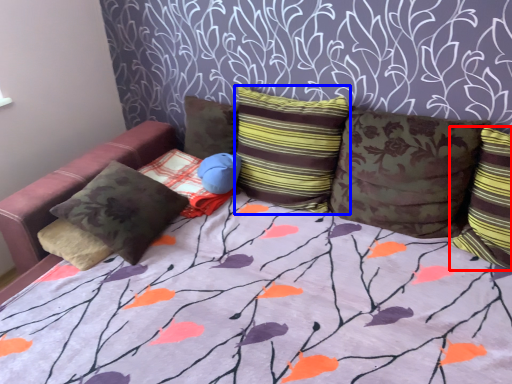
Question: Among these objects, which one is nearest to the camera, pillow (highlighted by a red box) or pillow (highlighted by a blue box)?

Choices:
 (A) pillow
 (B) pillow

Answer: (A)